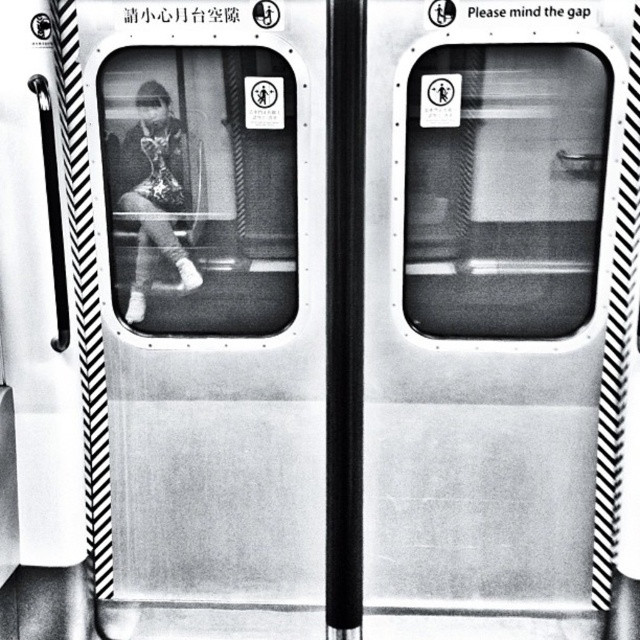
Question: Which point appears closest to the camera in this image?

Choices:
 (A) (339, 614)
 (B) (289, 340)

Answer: (A)

Question: Among these points, which one is farthest from the camera?

Choices:
 (A) (360, 577)
 (B) (122, 154)
 (C) (196, 401)

Answer: (C)

Question: Can you confirm if black glossy pole at center is positioned to the right of matte black jacket at center?

Choices:
 (A) yes
 (B) no

Answer: (A)

Question: Which object appears farthest from the camera in this image?

Choices:
 (A) metallic silver door at left
 (B) matte black jacket at center
 (C) black glossy pole at center

Answer: (B)

Question: Is black glossy pole at center to the left of matte black jacket at center from the viewer's perspective?

Choices:
 (A) yes
 (B) no

Answer: (B)

Question: Is metallic silver door at left positioned behind black glossy pole at center?

Choices:
 (A) no
 (B) yes

Answer: (B)